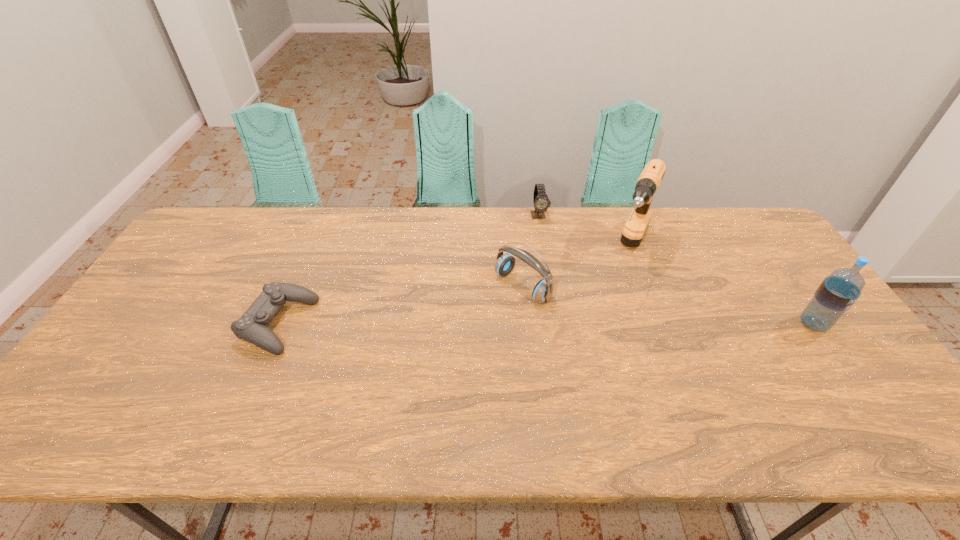
At what (x,y) coordinates should I click in order to perform the action: click on free spot on the desktop that is between the control and the rightmost object and is positioned on the face of the watch. Please return your answer as a coordinate pair (x, y). This screenshot has height=540, width=960. Looking at the image, I should click on (569, 325).

The width and height of the screenshot is (960, 540). Find the location of `free spot on the desktop that is between the shortest object and the rightmost object and is positioned at the tip of the second object from right to left`. free spot on the desktop that is between the shortest object and the rightmost object and is positioned at the tip of the second object from right to left is located at coordinates (594, 325).

Locate an element on the screen. The width and height of the screenshot is (960, 540). free space on the desktop that is between the leftmost object and the rightmost object and is positioned on the ear cups of the third shortest object is located at coordinates (471, 325).